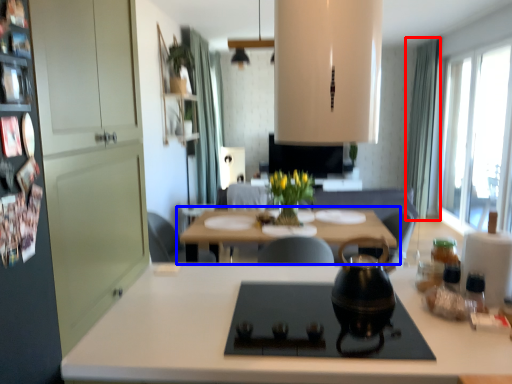
Question: Which object appears farthest to the camera in this image, curtain (highlighted by a red box) or table (highlighted by a blue box)?

Choices:
 (A) curtain
 (B) table

Answer: (A)